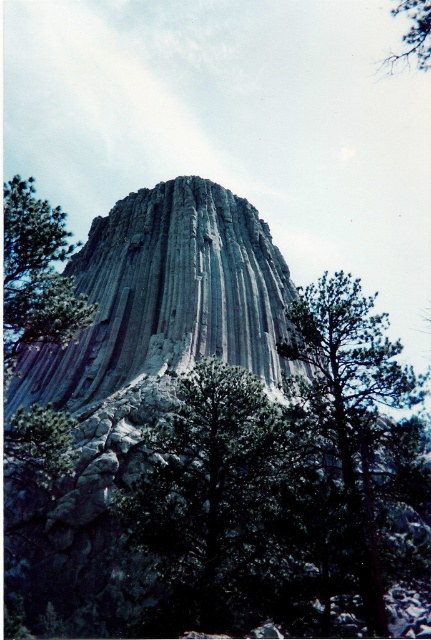
Is green leafy tree at center thinner than green matte tree at lower right?

Yes.

Where is `green leafy tree at center`? green leafy tree at center is located at coordinates (218, 500).

Locate an element on the screen. Image resolution: width=431 pixels, height=640 pixels. green leafy tree at center is located at coordinates (218, 500).

Which of these two, green matte tree at left or green matte tree at lower left, stands taller?

green matte tree at left is taller.

Between green matte tree at left and green matte tree at lower left, which one has less height?

With less height is green matte tree at lower left.

Who is more distant from viewer, (x=11, y=349) or (x=47, y=486)?

The point (x=47, y=486) is more distant.

You are a GUI agent. You are given a task and a screenshot of the screen. Output one action in this format:
    pyautogui.click(x=<x>, y=<y>)
    Task: Click on the green matte tree at left
    
    Given the screenshot: What is the action you would take?
    pyautogui.click(x=37, y=275)

Is green matte tree at left taller than green leafy tree at upper right?

No, green matte tree at left is not taller than green leafy tree at upper right.

How distant is green matte tree at left from green leafy tree at upper right?

green matte tree at left is 258.12 feet away from green leafy tree at upper right.

Locate an element on the screen. green matte tree at left is located at coordinates (37, 275).